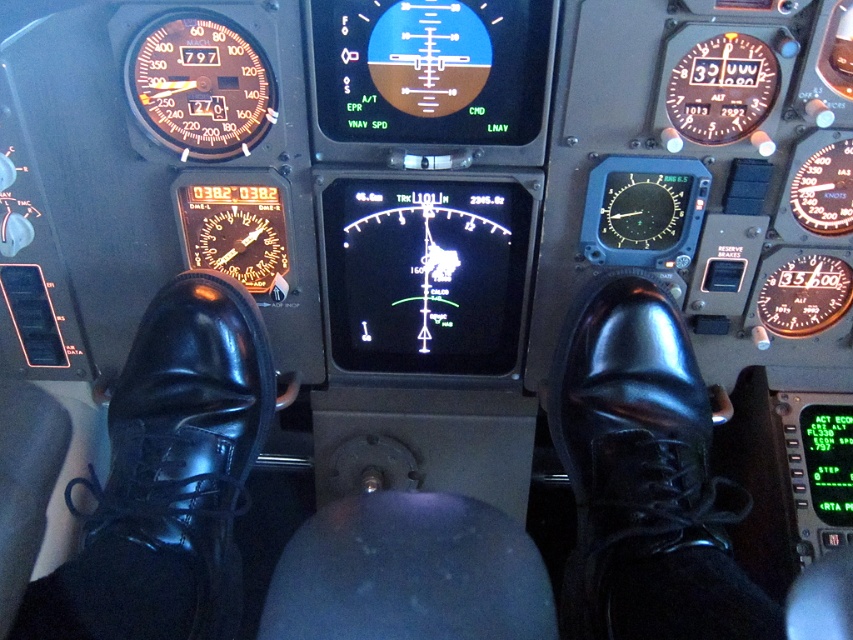
Question: Can you confirm if black leather shoe at center is thinner than shiny black shoe at lower left?

Choices:
 (A) no
 (B) yes

Answer: (B)

Question: Which of the following is the farthest from the observer?

Choices:
 (A) black leather shoe at center
 (B) shiny black shoe at lower left

Answer: (B)

Question: Which point is farther from the camera taking this photo?

Choices:
 (A) (83, 616)
 (B) (653, 522)

Answer: (B)

Question: Is the position of black leather shoe at center more distant than that of shiny black shoe at lower left?

Choices:
 (A) yes
 (B) no

Answer: (B)

Question: Does black leather shoe at center have a smaller size compared to shiny black shoe at lower left?

Choices:
 (A) yes
 (B) no

Answer: (A)

Question: Among these points, which one is farthest from the camera?

Choices:
 (A) (74, 572)
 (B) (602, 348)

Answer: (B)